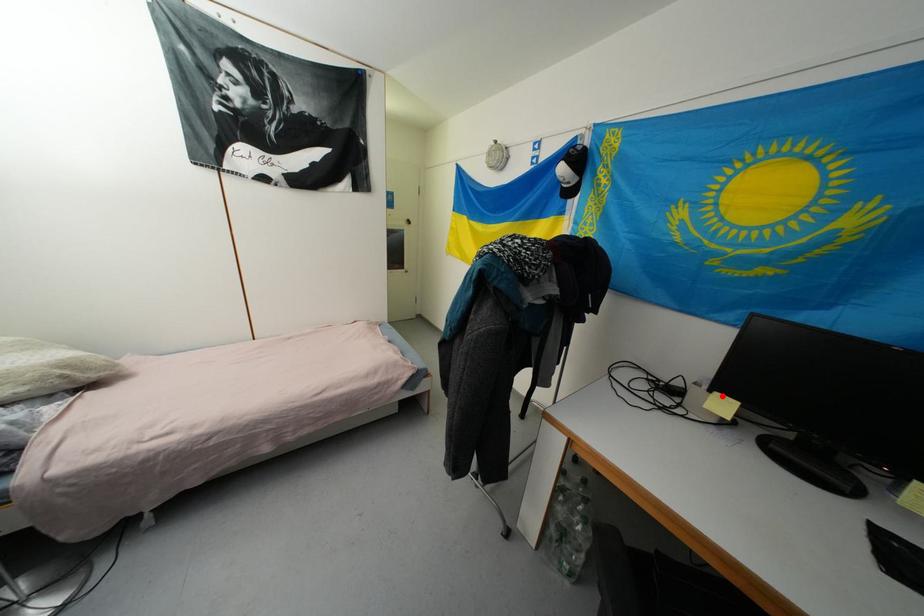
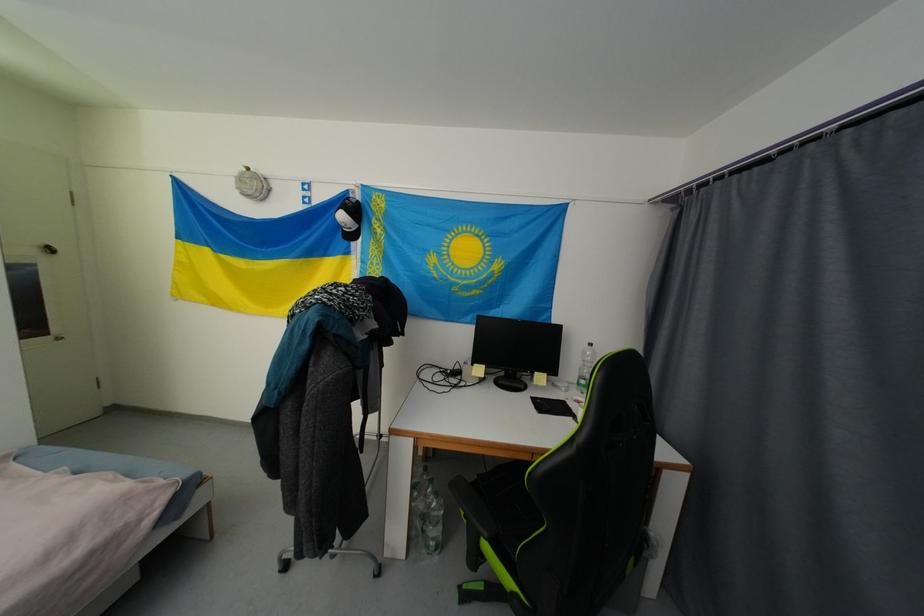
The point at the highlighted location is marked in the first image. Where is the corresponding point in the second image?

(480, 367)